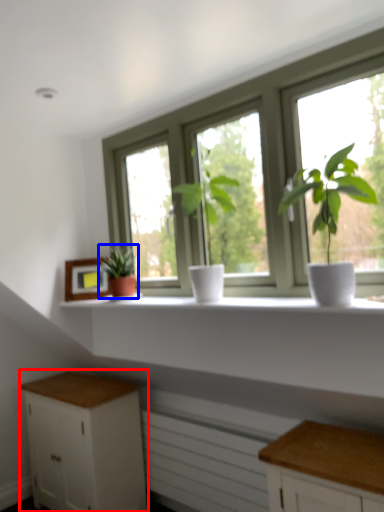
Question: Which object is closer to the camera taking this photo, cabinetry (highlighted by a red box) or houseplant (highlighted by a blue box)?

Choices:
 (A) cabinetry
 (B) houseplant

Answer: (B)